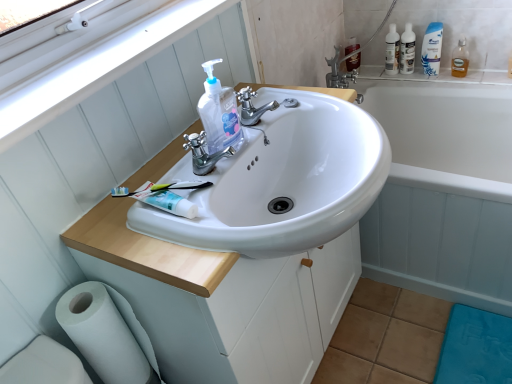
Where is `free location to the left of polished chrome faucet at center, arranged as the second tap when viewed from the back`? Image resolution: width=512 pixels, height=384 pixels. free location to the left of polished chrome faucet at center, arranged as the second tap when viewed from the back is located at coordinates (124, 201).